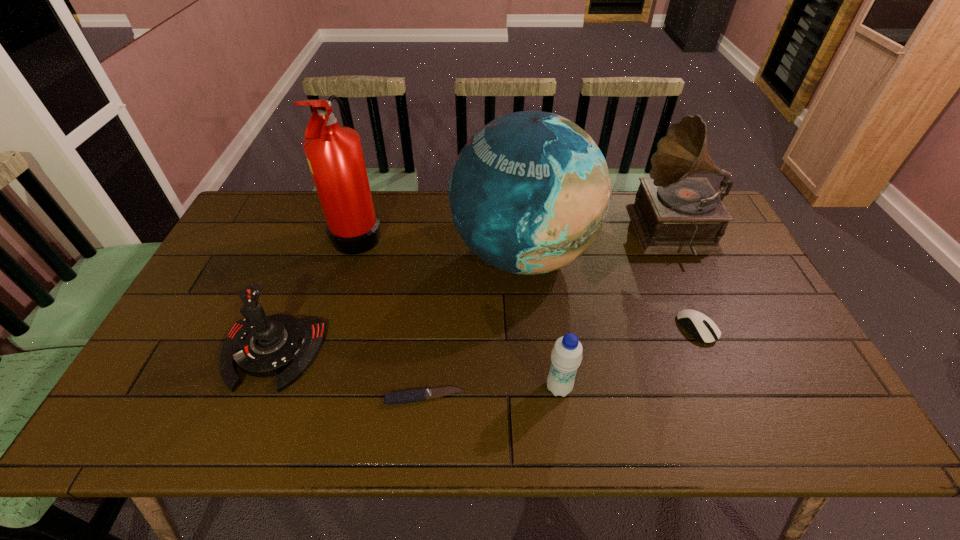
Where is `object situated at the right edge`? This screenshot has height=540, width=960. object situated at the right edge is located at coordinates (672, 214).

This screenshot has height=540, width=960. I want to click on object situated at the far right corner, so click(672, 214).

At what (x,y) coordinates should I click in order to perform the action: click on free point at the far edge. Please return your answer as a coordinate pair (x, y). Looking at the image, I should click on (375, 207).

In the image, there is a desktop. Where is `vacant space at the near edge`? This screenshot has height=540, width=960. vacant space at the near edge is located at coordinates (717, 436).

This screenshot has height=540, width=960. Find the location of `free space at the left edge of the desktop`. free space at the left edge of the desktop is located at coordinates (149, 389).

The height and width of the screenshot is (540, 960). What are the coordinates of `blank space at the right edge of the desktop` in the screenshot? It's located at (807, 399).

This screenshot has width=960, height=540. Identify the location of free location at the far left corner. (264, 199).

At what (x,y) coordinates should I click in order to perform the action: click on free space at the near right corner of the desktop. Please return your answer as a coordinate pair (x, y). Looking at the image, I should click on (794, 411).

You are a GUI agent. You are given a task and a screenshot of the screen. Output one action in this format:
    pyautogui.click(x=<x>, y=<y>)
    Task: Click on the vacant space that is in between the fire extinguisher and the water bottle
    The height and width of the screenshot is (540, 960).
    Given the screenshot: What is the action you would take?
    (x=459, y=310)

The image size is (960, 540). I want to click on vacant space in between the water bottle and the fire extinguisher, so click(459, 310).